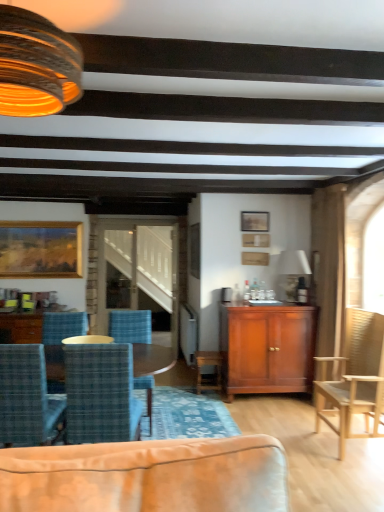
Question: Is wooden picture frame at upper center, acting as the second picture frame starting from the back, taller than matte white lampshade at upper center, arranged as the 2th lamp when viewed from the left?

Choices:
 (A) yes
 (B) no

Answer: (B)

Question: From a real-world perspective, is wooden picture frame at upper center, the second picture frame positioned from the left, under matte white lampshade at upper center, the second lamp when ordered from top to bottom?

Choices:
 (A) yes
 (B) no

Answer: (B)

Question: Is wooden picture frame at upper center, marked as the second picture frame in a front-to-back arrangement, thinner than matte white lampshade at upper center, the 1th lamp positioned from the back?

Choices:
 (A) no
 (B) yes

Answer: (B)

Question: Is wooden picture frame at upper center, arranged as the second picture frame when viewed from the right, not within matte white lampshade at upper center, the 1th lamp viewed from the right?

Choices:
 (A) no
 (B) yes

Answer: (B)

Question: From a real-world perspective, does wooden picture frame at upper center, the second picture frame positioned from the left, stand above matte white lampshade at upper center, the 1th lamp positioned from the back?

Choices:
 (A) yes
 (B) no

Answer: (A)

Question: From a real-world perspective, relative to wooden glossy coffee table at lower left, is matte wood cabinet at center vertically above or below?

Choices:
 (A) below
 (B) above

Answer: (B)

Question: Considering their positions, is matte wood cabinet at center located in front of or behind wooden glossy coffee table at lower left?

Choices:
 (A) front
 (B) behind

Answer: (A)

Question: Considering the positions of matte wood cabinet at center and wooden glossy coffee table at lower left in the image, is matte wood cabinet at center bigger or smaller than wooden glossy coffee table at lower left?

Choices:
 (A) big
 (B) small

Answer: (A)

Question: Is matte wood cabinet at center taller or shorter than wooden glossy coffee table at lower left?

Choices:
 (A) tall
 (B) short

Answer: (A)

Question: Considering the positions of matte wood cabinet at center and wooden chair at right in the image, is matte wood cabinet at center bigger or smaller than wooden chair at right?

Choices:
 (A) big
 (B) small

Answer: (A)

Question: From a real-world perspective, relative to wooden chair at right, is matte wood cabinet at center vertically above or below?

Choices:
 (A) above
 (B) below

Answer: (B)

Question: From the image's perspective, is matte wood cabinet at center located above or below wooden chair at right?

Choices:
 (A) above
 (B) below

Answer: (B)

Question: In the image, is matte wood cabinet at center on the left side or the right side of wooden chair at right?

Choices:
 (A) right
 (B) left

Answer: (B)

Question: In terms of height, does blue plaid fabric chair at center, which ranks as the 2th chair in right-to-left order, look taller or shorter compared to wooden picture frame at upper center, acting as the second picture frame starting from the back?

Choices:
 (A) tall
 (B) short

Answer: (A)

Question: Visually, is blue plaid fabric chair at center, which ranks as the 2th chair in right-to-left order, positioned to the left or to the right of wooden picture frame at upper center, arranged as the second picture frame when viewed from the right?

Choices:
 (A) right
 (B) left

Answer: (B)